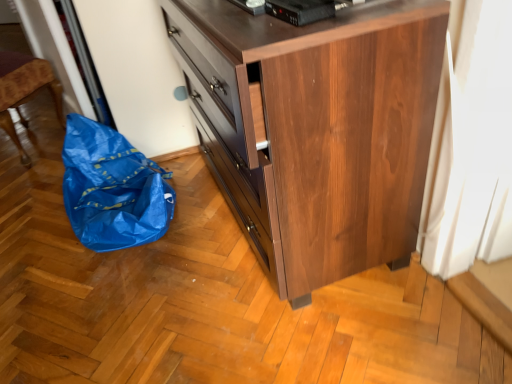
Question: Is black plastic device at upper center turned away from brown wood chest of drawers at center?

Choices:
 (A) yes
 (B) no

Answer: (B)

Question: Is black plastic device at upper center bigger than brown wood chest of drawers at center?

Choices:
 (A) no
 (B) yes

Answer: (A)

Question: Can you confirm if black plastic device at upper center is positioned to the right of brown wood chest of drawers at center?

Choices:
 (A) no
 (B) yes

Answer: (B)

Question: Is black plastic device at upper center closer to camera compared to brown wood chest of drawers at center?

Choices:
 (A) no
 (B) yes

Answer: (A)

Question: From the image's perspective, is black plastic device at upper center under brown wood chest of drawers at center?

Choices:
 (A) yes
 (B) no

Answer: (B)

Question: Does black plastic device at upper center contain brown wood chest of drawers at center?

Choices:
 (A) yes
 (B) no

Answer: (B)

Question: From a real-world perspective, is brown wood chest of drawers at center positioned over blue plastic bag at left based on gravity?

Choices:
 (A) yes
 (B) no

Answer: (A)

Question: Does brown wood chest of drawers at center lie in front of blue plastic bag at left?

Choices:
 (A) no
 (B) yes

Answer: (B)

Question: Can you confirm if brown wood chest of drawers at center is positioned to the right of blue plastic bag at left?

Choices:
 (A) no
 (B) yes

Answer: (B)

Question: Is brown wood chest of drawers at center facing away from blue plastic bag at left?

Choices:
 (A) no
 (B) yes

Answer: (A)

Question: Is the position of brown wood chest of drawers at center more distant than that of blue plastic bag at left?

Choices:
 (A) yes
 (B) no

Answer: (B)

Question: Is brown wood chest of drawers at center at the left side of blue plastic bag at left?

Choices:
 (A) no
 (B) yes

Answer: (A)

Question: Does blue plastic bag at left touch black plastic device at upper center?

Choices:
 (A) yes
 (B) no

Answer: (B)